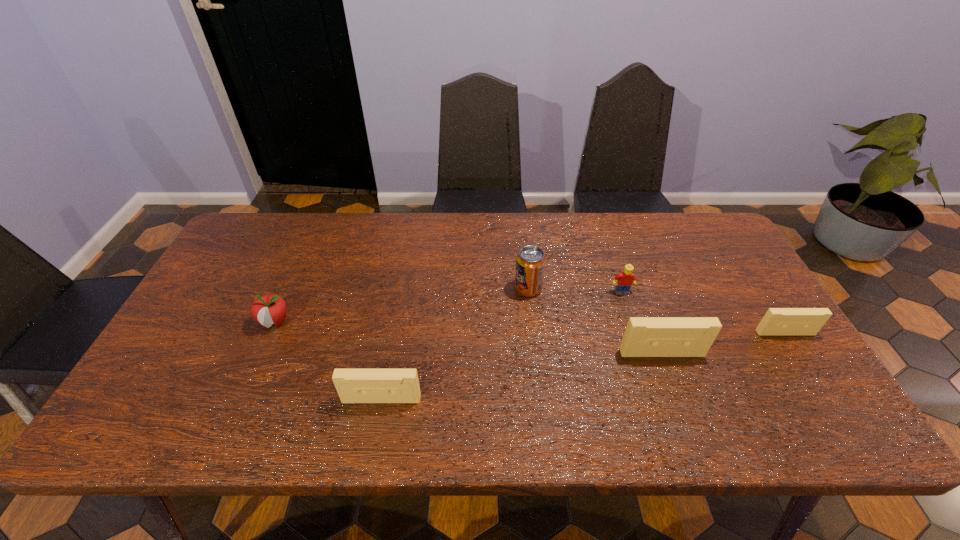
Locate an element on the screen. The width and height of the screenshot is (960, 540). the nearest videotape is located at coordinates (353, 385).

Find the location of `the fifth object from right to left`. the fifth object from right to left is located at coordinates (353, 385).

The width and height of the screenshot is (960, 540). In order to click on the second videotape from left to right in this screenshot , I will do `click(644, 336)`.

The width and height of the screenshot is (960, 540). Identify the location of the second nearest videotape. (644, 336).

This screenshot has width=960, height=540. I want to click on the shortest videotape, so click(777, 321).

Where is `the shortest object`? This screenshot has width=960, height=540. the shortest object is located at coordinates (777, 321).

The image size is (960, 540). I want to click on apple, so click(271, 308).

Where is `Lego`? The image size is (960, 540). Lego is located at coordinates (624, 280).

At what (x,y) coordinates should I click in order to perform the action: click on soda can. Please return your answer as a coordinate pair (x, y). The width and height of the screenshot is (960, 540). Looking at the image, I should click on (530, 263).

Find the location of a particular element. This screenshot has height=540, width=960. vacant space located at the front of the shortest videotape with spools is located at coordinates (820, 387).